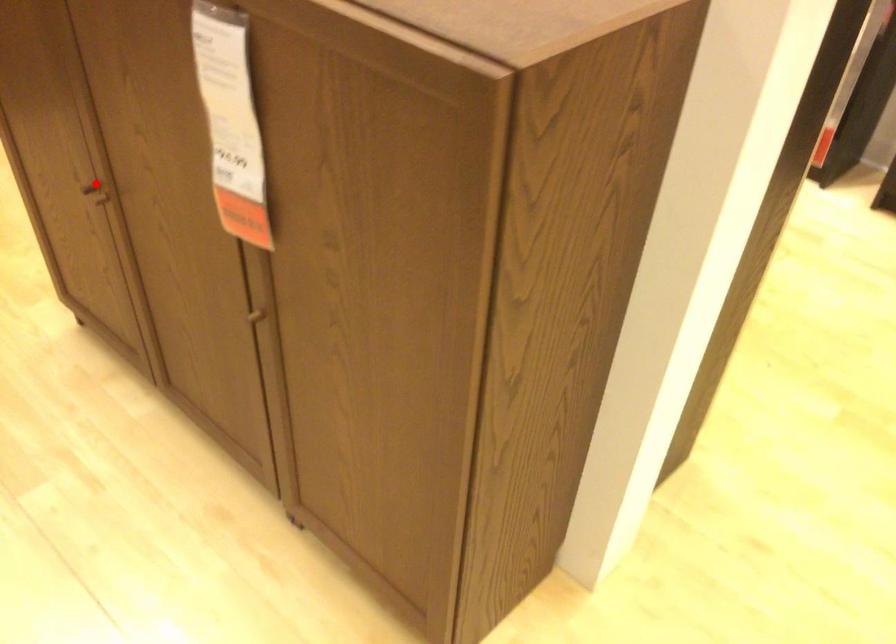
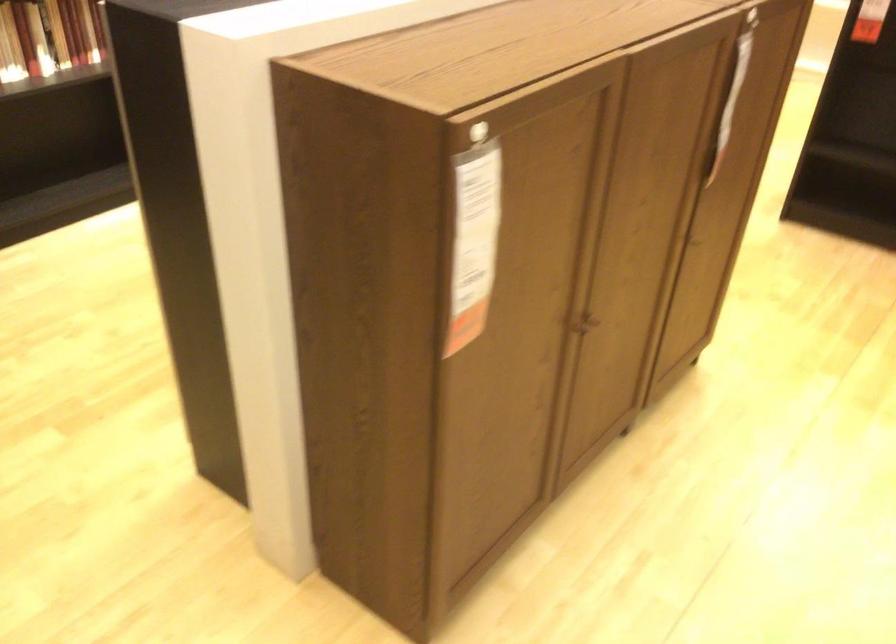
In the second image, find the point that corresponds to the highlighted location in the first image.

(583, 323)